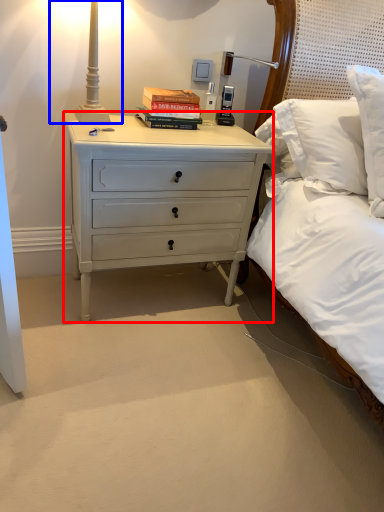
Question: Which point is further to the camera, nightstand (highlighted by a red box) or bedside lamp (highlighted by a blue box)?

Choices:
 (A) nightstand
 (B) bedside lamp

Answer: (A)